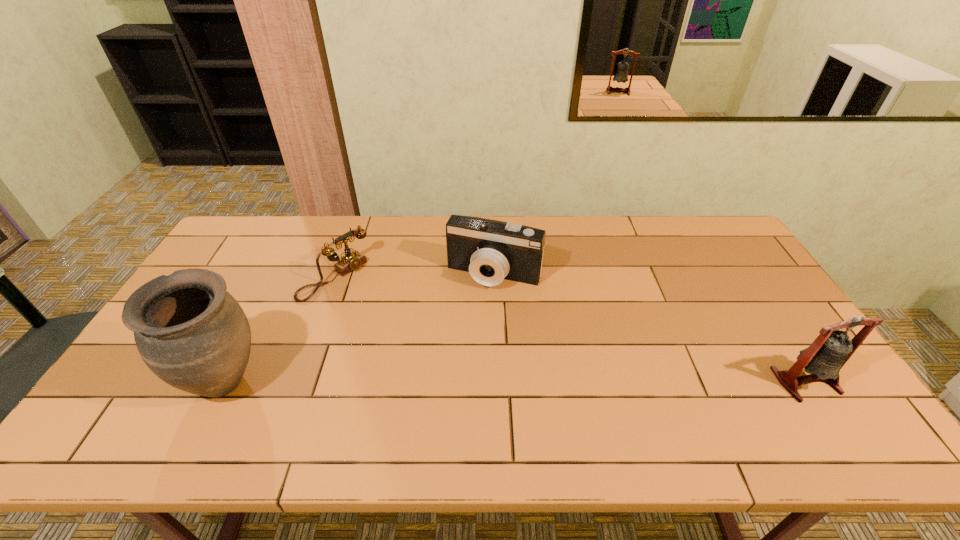
This screenshot has height=540, width=960. I want to click on urn, so click(x=191, y=333).

Where is `the rightmost object`? This screenshot has width=960, height=540. the rightmost object is located at coordinates coord(823,359).

At what (x,y) coordinates should I click in order to perform the action: click on bell. Please return your answer as a coordinate pair (x, y). Looking at the image, I should click on (823, 359).

Locate an element on the screen. The width and height of the screenshot is (960, 540). the second object from right to left is located at coordinates (490, 250).

At what (x,y) coordinates should I click in order to perform the action: click on the second shortest object. Please return your answer as a coordinate pair (x, y). Looking at the image, I should click on (490, 250).

The image size is (960, 540). Find the location of `the shortest object`. the shortest object is located at coordinates [350, 261].

Identify the location of free space located 0.260m on the right of the urn. The image size is (960, 540). [x=371, y=382].

This screenshot has height=540, width=960. I want to click on free point located on the back of the bell, so [x=762, y=314].

Find the location of a particular element. free space located on the lens of the second object from right to left is located at coordinates (473, 311).

Identify the location of vacant space positioned 0.190m on the lens of the second object from right to left. The image size is (960, 540). (461, 339).